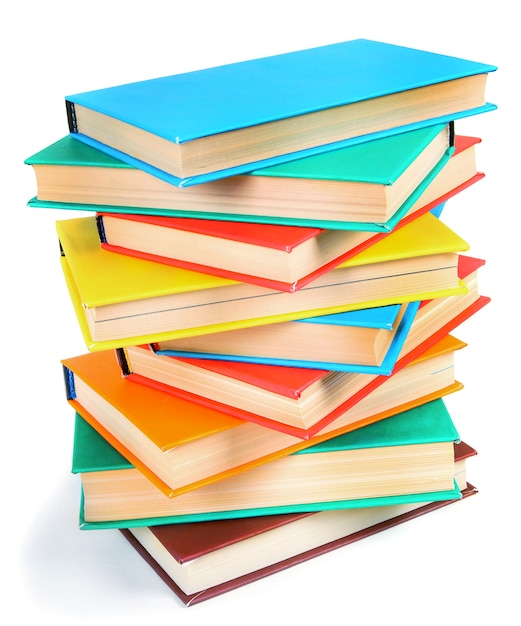
Locate an element on the screen. Image resolution: width=521 pixels, height=626 pixels. hardcover books is located at coordinates (228, 128), (326, 190), (270, 245), (199, 299), (301, 340), (255, 392), (188, 426), (321, 486), (259, 543).